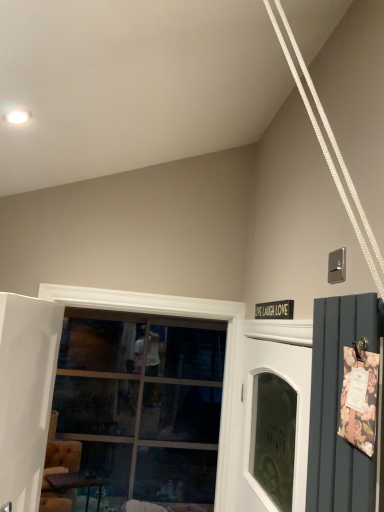
You are a GUI agent. You are given a task and a screenshot of the screen. Output one action in this format:
    pyautogui.click(x=<x>, y=<y>)
    Task: Click on the clear glass window at center
    The height and width of the screenshot is (512, 384).
    Given the screenshot: What is the action you would take?
    pyautogui.click(x=160, y=399)

Image resolution: width=384 pixels, height=512 pixels. What do you see at coordinates (160, 399) in the screenshot?
I see `clear glass window at center` at bounding box center [160, 399].

Where is `white glass door at center`? white glass door at center is located at coordinates (274, 426).

The height and width of the screenshot is (512, 384). What do you see at coordinates (274, 426) in the screenshot?
I see `white glass door at center` at bounding box center [274, 426].

The width and height of the screenshot is (384, 512). I want to click on white glossy door at left, so click(26, 394).

Between white glossy door at left and clear glass window at center, which one has larger width?

Wider between the two is clear glass window at center.

Identify the location of door in front of the clear glass window at center. This screenshot has width=384, height=512. (26, 394).

Which is correct: white glossy door at left is inside clear glass window at center, or outside of it?

white glossy door at left is spatially situated outside clear glass window at center.

In the image, there is a white glossy door at left. Where is `window below it (from the image's perspective)`? This screenshot has width=384, height=512. window below it (from the image's perspective) is located at coordinates tap(160, 399).

Considering the relative sizes of clear glass window at center and white glossy door at left in the image provided, is clear glass window at center smaller than white glossy door at left?

Incorrect, clear glass window at center is not smaller in size than white glossy door at left.

Does clear glass window at center have a lesser height compared to white glossy door at left?

Incorrect, the height of clear glass window at center does not fall short of that of white glossy door at left.

From the image's perspective, is clear glass window at center above white glossy door at left?

No, from the image's perspective, clear glass window at center is not above white glossy door at left.

In the image, is white glossy door at left positioned in front of or behind white glass door at center?

Visually, white glossy door at left is located in front of white glass door at center.

What's the angular difference between white glossy door at left and white glass door at center's facing directions?

The angular difference between white glossy door at left and white glass door at center is 179 degrees.

Is white glossy door at left taller or shorter than white glass door at center?

In the image, white glossy door at left appears to be taller than white glass door at center.

Which object is wider, white glossy door at left or white glass door at center?

white glass door at center.

Between wooden table at lower left and white glass door at center, which one has larger size?

With larger size is white glass door at center.

Between wooden table at lower left and white glass door at center, which one appears on the right side from the viewer's perspective?

From the viewer's perspective, white glass door at center appears more on the right side.

How much distance is there between wooden table at lower left and white glass door at center?

They are 8.01 feet apart.

From the image's perspective, relative to clear glass window at center, is white glass door at center above or below?

Based on their image positions, white glass door at center is located beneath clear glass window at center.

Would you say white glass door at center is a long distance from clear glass window at center?

Indeed, white glass door at center is not near clear glass window at center.

Can clear glass window at center be found inside white glass door at center?

No, clear glass window at center is not inside white glass door at center.

From a real-world perspective, is white glass door at center positioned under clear glass window at center based on gravity?

Yes, from a real-world perspective, white glass door at center is beneath clear glass window at center.

Does wooden table at lower left have a greater width compared to white glossy door at left?

Yes.

Choose the correct answer: Is wooden table at lower left inside white glossy door at left or outside it?

wooden table at lower left is spatially situated outside white glossy door at left.

Between wooden table at lower left and white glossy door at left, which one has more height?

white glossy door at left.

Can you see wooden table at lower left touching white glossy door at left?

wooden table at lower left and white glossy door at left are not in contact.

How many degrees apart are the facing directions of white glass door at center and white glossy door at left?

The angle between the facing direction of white glass door at center and the facing direction of white glossy door at left is 179 degrees.

Is white glass door at center turned away from white glossy door at left?

Yes, white glossy door at left is at the back of white glass door at center.

I want to click on garage door below the white glossy door at left (from the image's perspective), so click(x=274, y=426).

Is white glass door at center not within white glossy door at left?

white glass door at center is positioned outside white glossy door at left.

Where is `door that appears in front of the clear glass window at center`? door that appears in front of the clear glass window at center is located at coordinates (x=26, y=394).

Locate an element on the screen. window behind the white glossy door at left is located at coordinates (160, 399).

Based on their spatial positions, is white glossy door at left or white glass door at center closer to wooden table at lower left?

Based on the image, white glossy door at left appears to be nearer to wooden table at lower left.

Based on their spatial positions, is white glossy door at left or clear glass window at center closer to wooden table at lower left?

clear glass window at center is positioned closer to the anchor wooden table at lower left.

From the image, which object appears to be farther from clear glass window at center, wooden table at lower left or white glass door at center?

white glass door at center is further to clear glass window at center.

Looking at the image, which one is located closer to white glossy door at left, white glass door at center or wooden table at lower left?

white glass door at center is positioned closer to the anchor white glossy door at left.

Considering their positions, is clear glass window at center positioned closer to white glass door at center than wooden table at lower left?

wooden table at lower left is closer to white glass door at center.

Based on their spatial positions, is white glass door at center or white glossy door at left further from wooden table at lower left?

white glass door at center is positioned further to the anchor wooden table at lower left.

Estimate the real-world distances between objects in this image. Which object is further from white glossy door at left, wooden table at lower left or clear glass window at center?

clear glass window at center is further to white glossy door at left.

From the image, which object appears to be farther from clear glass window at center, wooden table at lower left or white glossy door at left?

white glossy door at left lies further to clear glass window at center than the other object.

This screenshot has height=512, width=384. In order to click on window between white glass door at center and wooden table at lower left along the z-axis in this screenshot , I will do `click(160, 399)`.

Find the location of `garage door located between white glossy door at left and clear glass window at center in the depth direction`. garage door located between white glossy door at left and clear glass window at center in the depth direction is located at coordinates (274, 426).

Where is `window between white glossy door at left and wooden table at lower left in the front-back direction`? The width and height of the screenshot is (384, 512). window between white glossy door at left and wooden table at lower left in the front-back direction is located at coordinates (160, 399).

The height and width of the screenshot is (512, 384). Find the location of `garage door positioned between white glossy door at left and wooden table at lower left from near to far`. garage door positioned between white glossy door at left and wooden table at lower left from near to far is located at coordinates (274, 426).